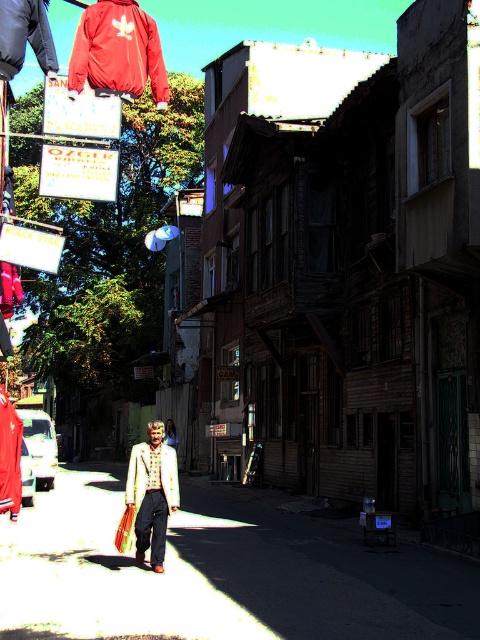
Is matte red jacket at upper left taller than white textured jacket at center?

Yes, matte red jacket at upper left is taller than white textured jacket at center.

Between matte red jacket at upper left and white textured jacket at center, which one is positioned higher?

matte red jacket at upper left is higher up.

Is point (118, 84) closer to viewer compared to point (149, 452)?

No, it is behind (149, 452).

Identify the location of matte red jacket at upper left. (118, 51).

Can you confirm if matte red jacket at upper left is positioned to the right of matte beige dress at center?

Yes, matte red jacket at upper left is to the right of matte beige dress at center.

Who is higher up, matte red jacket at upper left or matte beige dress at center?

Result: Positioned higher is matte red jacket at upper left.

Between point (127, 35) and point (168, 422), which one is positioned in front?

Positioned in front is point (127, 35).

You are a GUI agent. You are given a task and a screenshot of the screen. Output one action in this format:
    pyautogui.click(x=<x>, y=<y>)
    Task: Click on the matte red jacket at upper left
    Image resolution: width=480 pixels, height=640 pixels.
    Given the screenshot: What is the action you would take?
    pyautogui.click(x=118, y=51)

Locate an element on the screen. white textured jacket at center is located at coordinates (152, 492).

Is white textured jacket at center to the left of matte beige dress at center from the viewer's perspective?

Incorrect, white textured jacket at center is not on the left side of matte beige dress at center.

Is point (162, 548) positioned in front of point (166, 438)?

Yes, it is in front of point (166, 438).

This screenshot has width=480, height=640. Find the location of `white textured jacket at center`. white textured jacket at center is located at coordinates (152, 492).